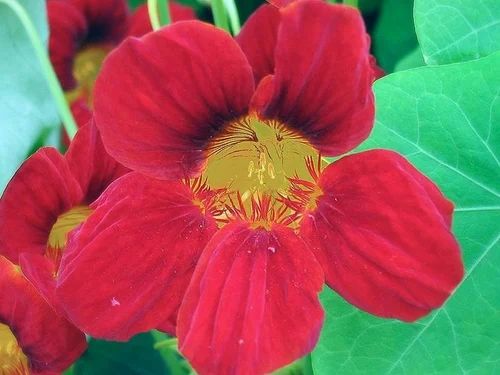
Locate an element on the screen. black shade is located at coordinates (211, 123), (301, 120), (277, 108), (310, 135), (202, 134), (98, 28), (81, 36).